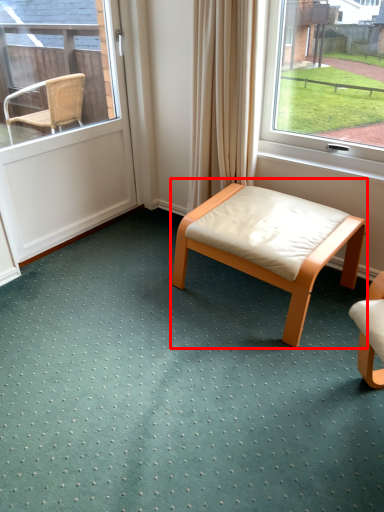
Question: In this image, where is table (annotated by the red box) located relative to door?

Choices:
 (A) left
 (B) right

Answer: (B)